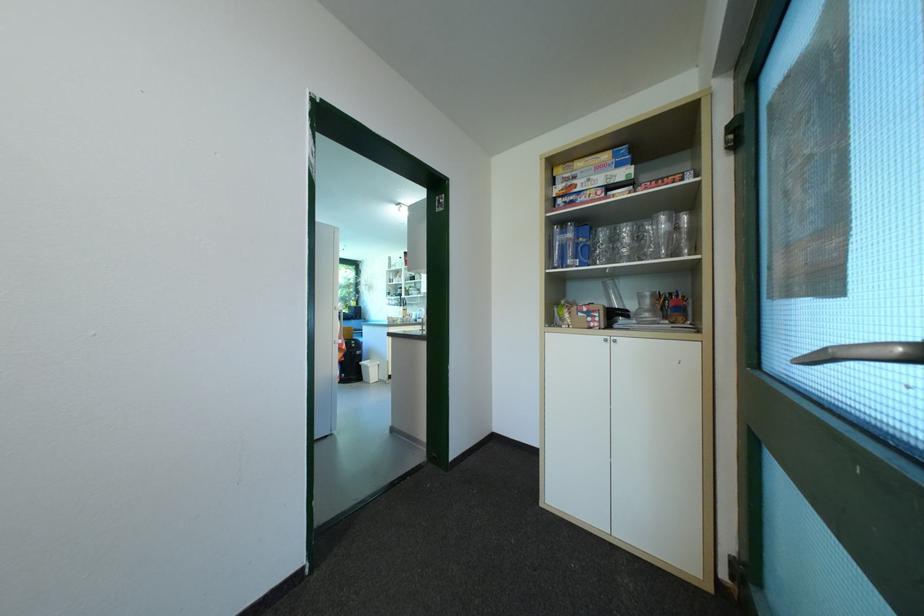
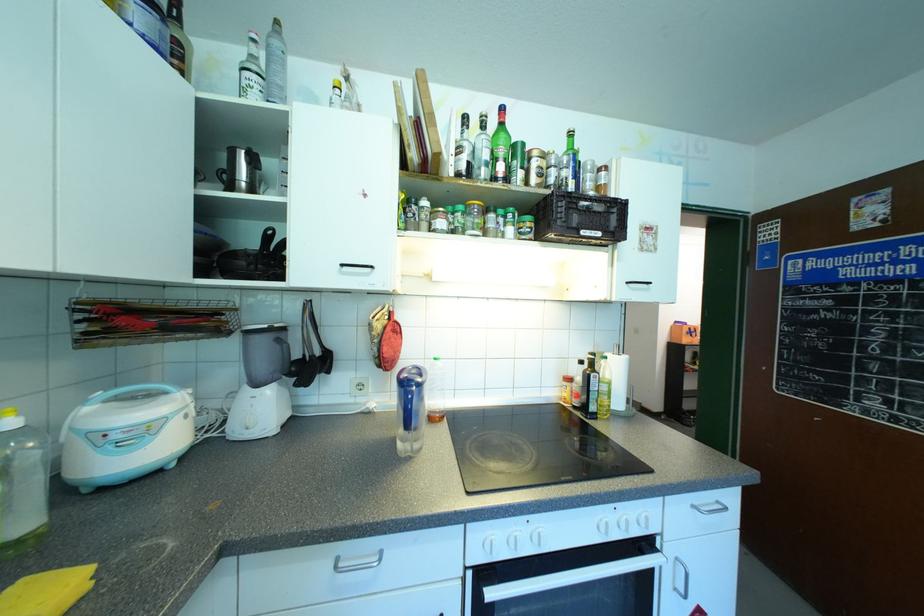
Question: I am providing you with two images of the same scene from different viewpoints. Which of the following objects are not visible in image2?

Choices:
 (A) yellow toy animal
 (B) glass mug
 (C) blue pitcher handle
 (D) metal kettle

Answer: (B)